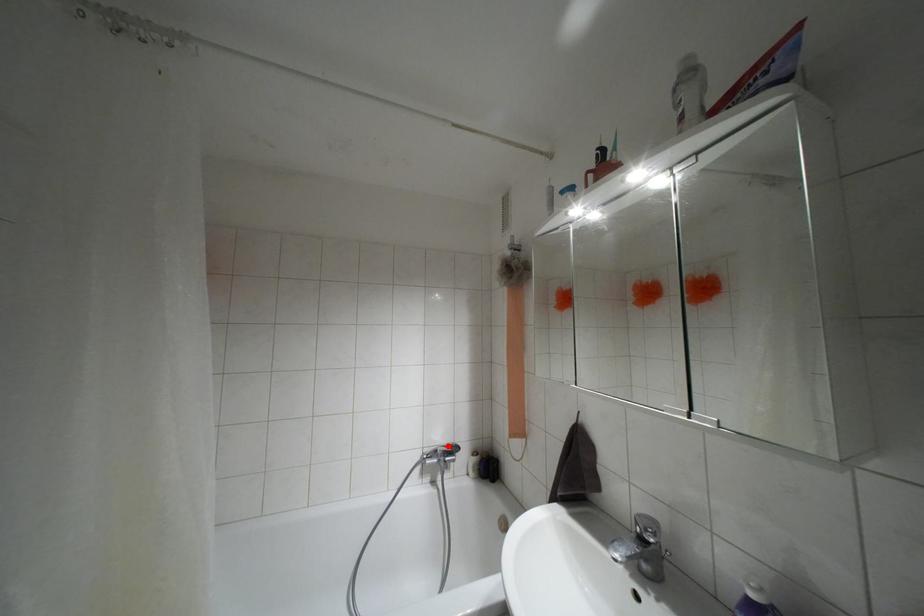
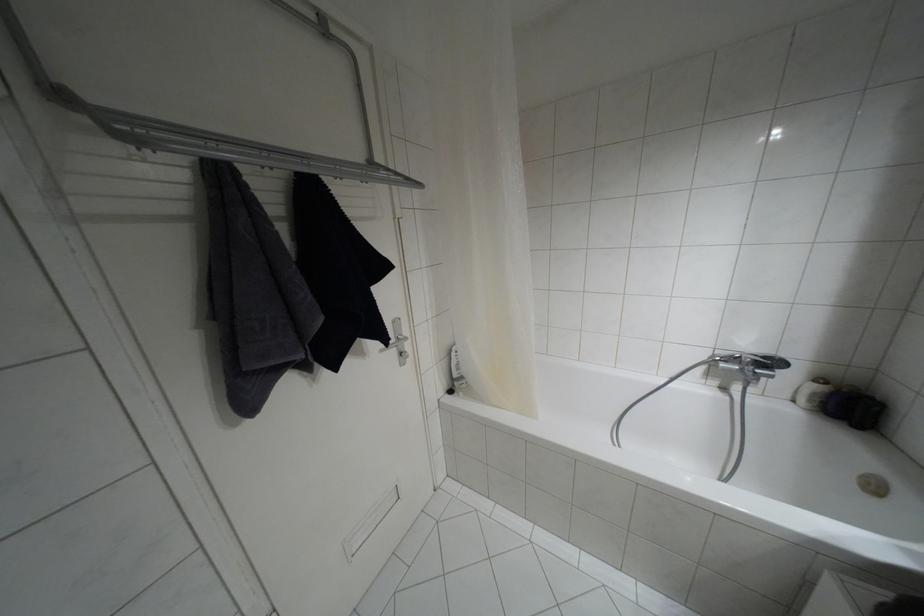
Question: I am providing you with two images of the same scene from different viewpoints. A red point is marked on the first image. Is the red point's position out of view in image 2?

Choices:
 (A) Yes
 (B) No

Answer: (B)